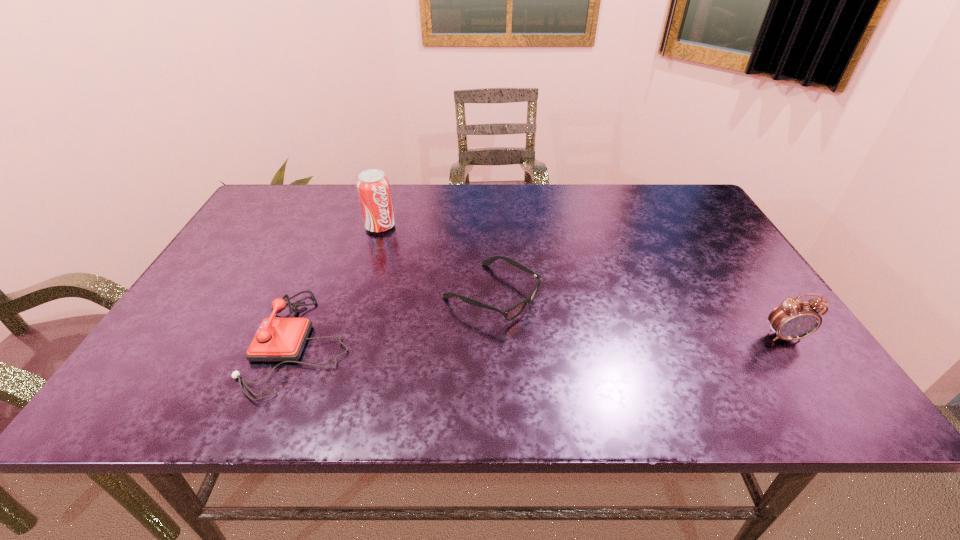
At what (x,y) coordinates should I click in order to perform the action: click on the second shortest object. Please return your answer as a coordinate pair (x, y). Looking at the image, I should click on (277, 339).

Image resolution: width=960 pixels, height=540 pixels. Find the location of `alarm clock`. alarm clock is located at coordinates (794, 319).

The width and height of the screenshot is (960, 540). I want to click on the rightmost object, so click(x=794, y=319).

Image resolution: width=960 pixels, height=540 pixels. I want to click on the tallest object, so click(373, 188).

Where is `soda can`? This screenshot has height=540, width=960. soda can is located at coordinates (373, 188).

At what (x,y) coordinates should I click in order to perform the action: click on the shortest object. Please return your answer as a coordinate pair (x, y). Looking at the image, I should click on [511, 313].

Locate an element on the screen. This screenshot has height=540, width=960. the third object from left to right is located at coordinates (511, 313).

The image size is (960, 540). Identify the location of free space located 0.100m on the dial of the second shortest object. (204, 342).

Find the location of `vacant space located on the dial of the second shortest object`. vacant space located on the dial of the second shortest object is located at coordinates (161, 342).

Identify the location of free space located on the logo side of the soda can. The width and height of the screenshot is (960, 540). click(x=422, y=266).